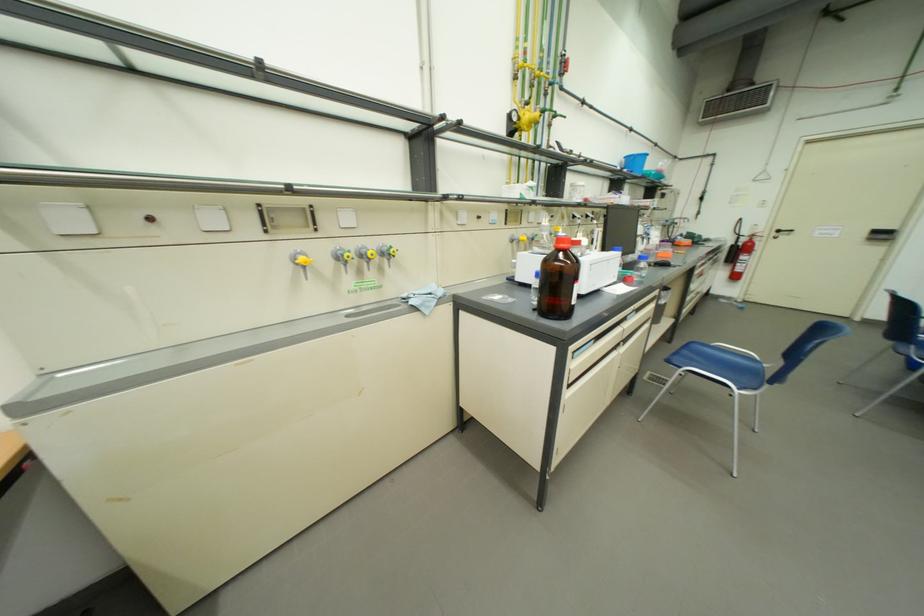
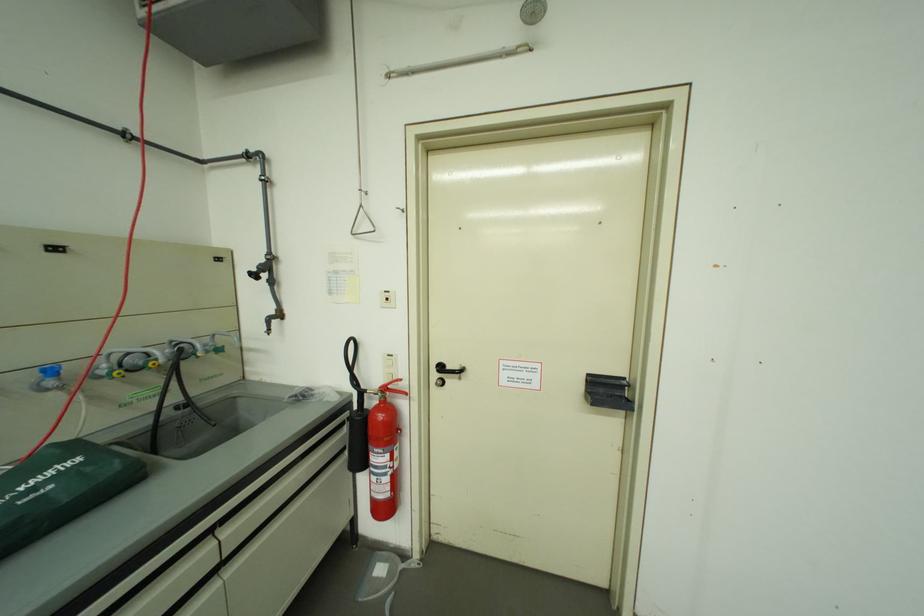
Find the pixel in the second image that matches (881,232) in the first image.

(598, 377)